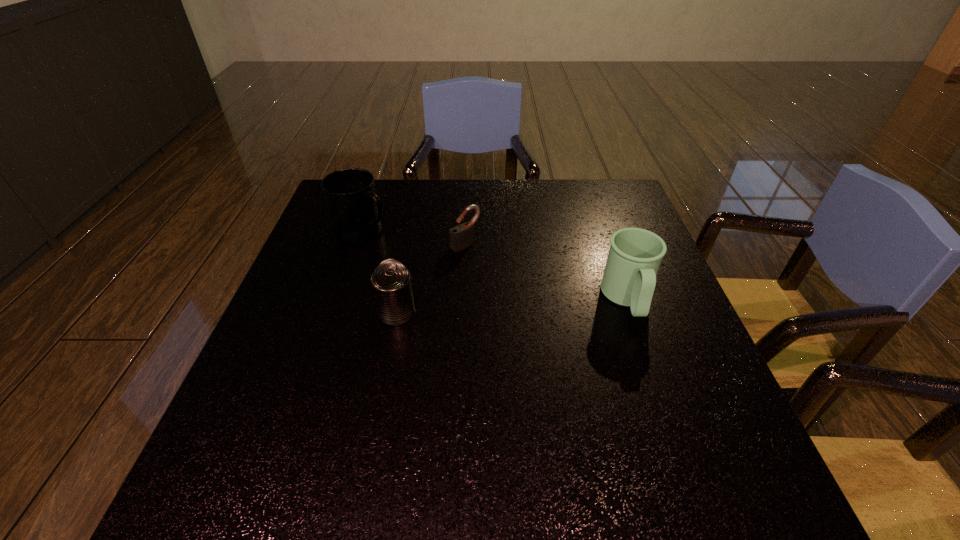
The width and height of the screenshot is (960, 540). What are the coordinates of `vacant area situated 0.180m on the side of the leftmost object with the handle` in the screenshot? It's located at (436, 263).

At what (x,y) coordinates should I click in order to perform the action: click on vacant region located 0.180m on the side of the leftmost object with the handle. Please return your answer as a coordinate pair (x, y). Image resolution: width=960 pixels, height=540 pixels. Looking at the image, I should click on (436, 263).

Where is `vacant area located with the keyhole on the front of the third object from left to right`? This screenshot has height=540, width=960. vacant area located with the keyhole on the front of the third object from left to right is located at coordinates (577, 335).

Identify the location of free space located with the keyhole on the front of the third object from left to right. The image size is (960, 540). (530, 296).

Where is `vacant space situated with the keyhole on the front of the third object from left to right`? Image resolution: width=960 pixels, height=540 pixels. vacant space situated with the keyhole on the front of the third object from left to right is located at coordinates (509, 279).

Where is `object situated at the far edge`? Image resolution: width=960 pixels, height=540 pixels. object situated at the far edge is located at coordinates point(355,210).

I want to click on object that is at the left edge, so click(355, 210).

The image size is (960, 540). I want to click on object at the right edge, so click(x=635, y=254).

You are a GUI agent. You are given a task and a screenshot of the screen. Output one action in this format:
    pyautogui.click(x=<x>, y=<y>)
    Task: Click on the object located at the far left corner
    This screenshot has height=540, width=960.
    Given the screenshot: What is the action you would take?
    pyautogui.click(x=355, y=210)

At what (x,y) coordinates should I click in order to perform the action: click on free space at the far edge of the desktop. Please return your answer as a coordinate pair (x, y). The image size is (960, 540). Looking at the image, I should click on (436, 182).